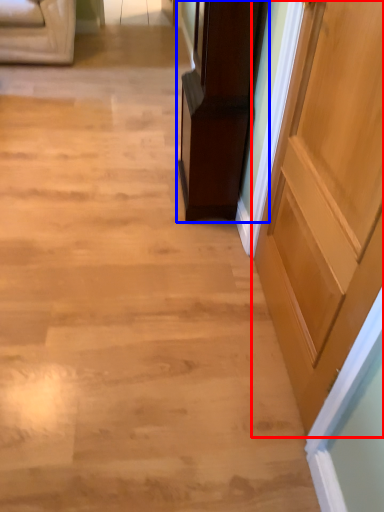
Question: Which of the following is the closest to the observer, door (highlighted by a red box) or furniture (highlighted by a blue box)?

Choices:
 (A) door
 (B) furniture

Answer: (A)